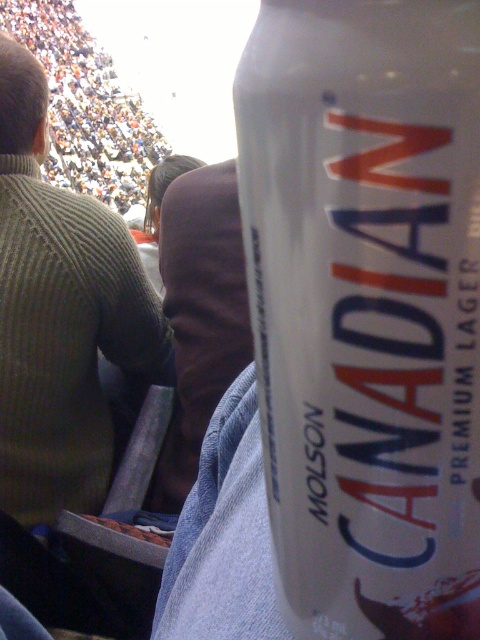
You are at a sports event and holding a white matte can at center. You want to place it between your green ribbed sweater at upper left and a jacket on your other side. Which side should you place the can to ensure it fits without falling over?

The white matte can at center is thinner than the green ribbed sweater at upper left, so placing it between the green ribbed sweater at upper left and the jacket would allow it to fit securely without falling over.

You are at a crowded sports event and holding a drink. You notice two items in your line of sight. The first is the white matte can at center, and the second is the green ribbed sweater at upper left. Which item is closer to you?

The white matte can at center is closer to you because it is in front of the green ribbed sweater at upper left.